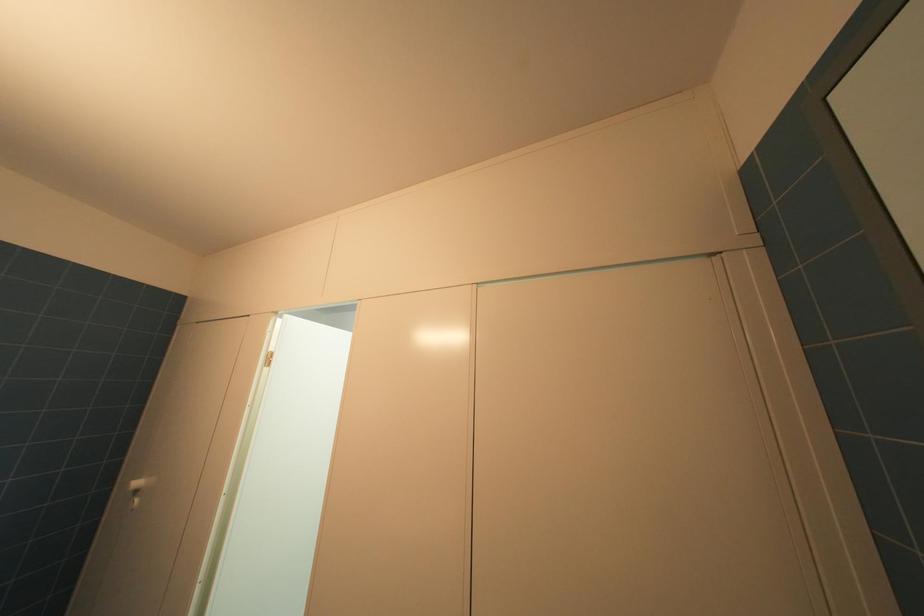
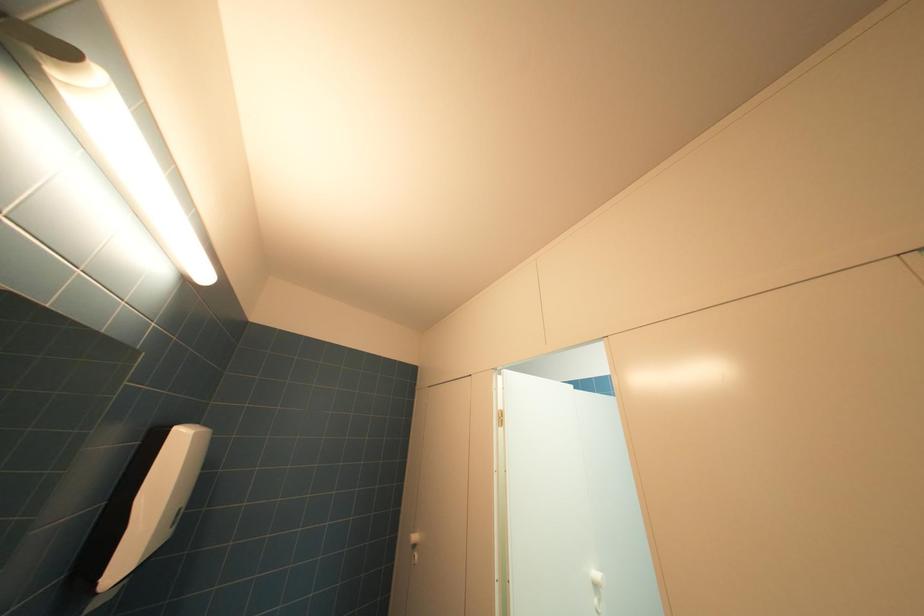
Question: How did the camera likely rotate?

Choices:
 (A) Left
 (B) Right
 (C) Up
 (D) Down

Answer: (A)